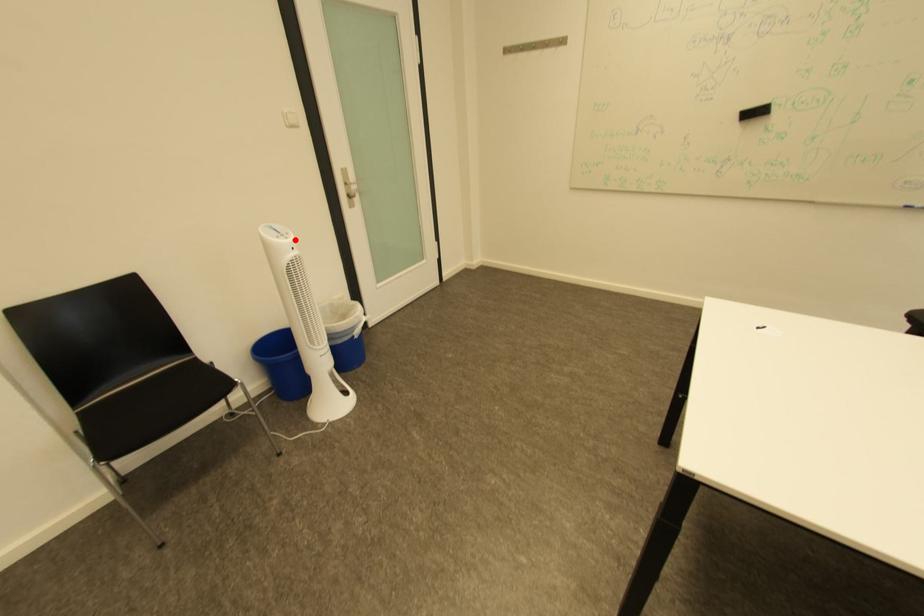
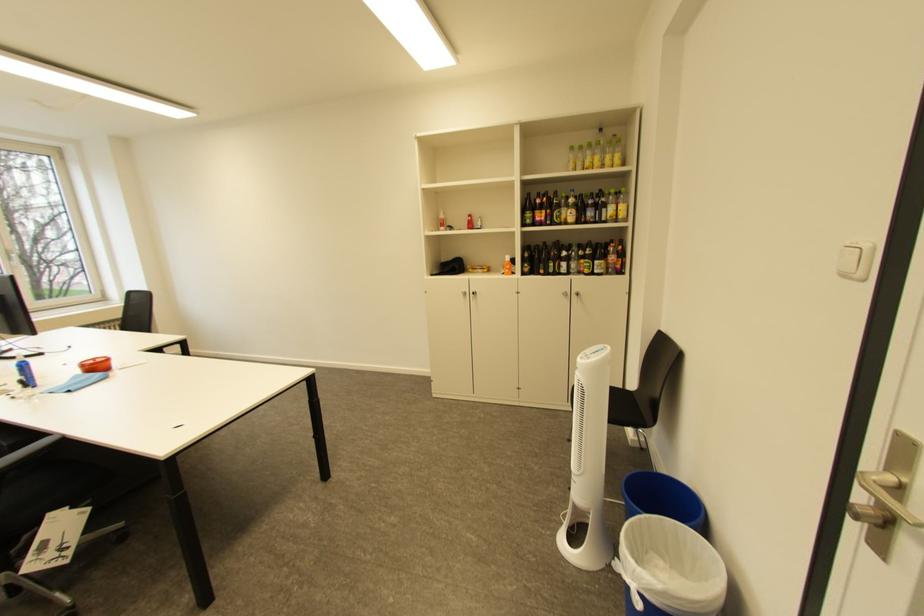
Question: I am providing you with two images of the same scene from different viewpoints. Given a red point in image1, look at the same physical point in image2. Is it:

Choices:
 (A) Closer to the viewpoint
 (B) Farther from the viewpoint

Answer: (B)